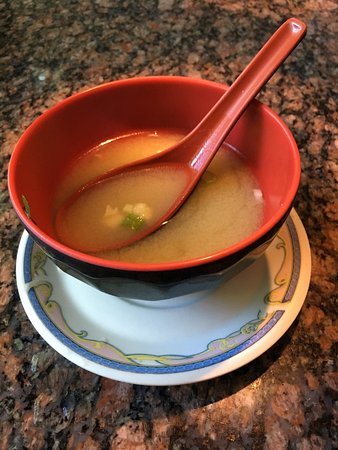
Image resolution: width=338 pixels, height=450 pixels. I want to click on plate, so click(x=185, y=343).